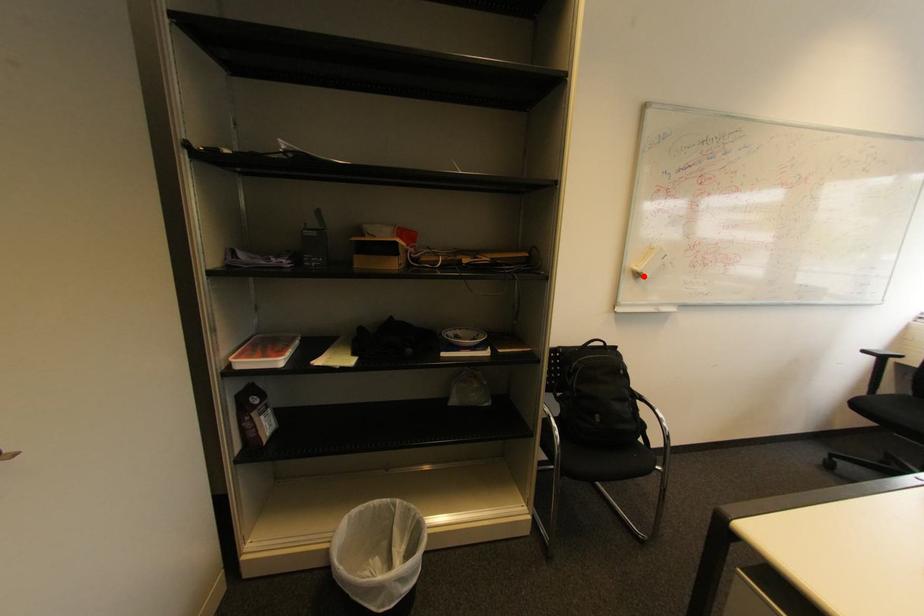
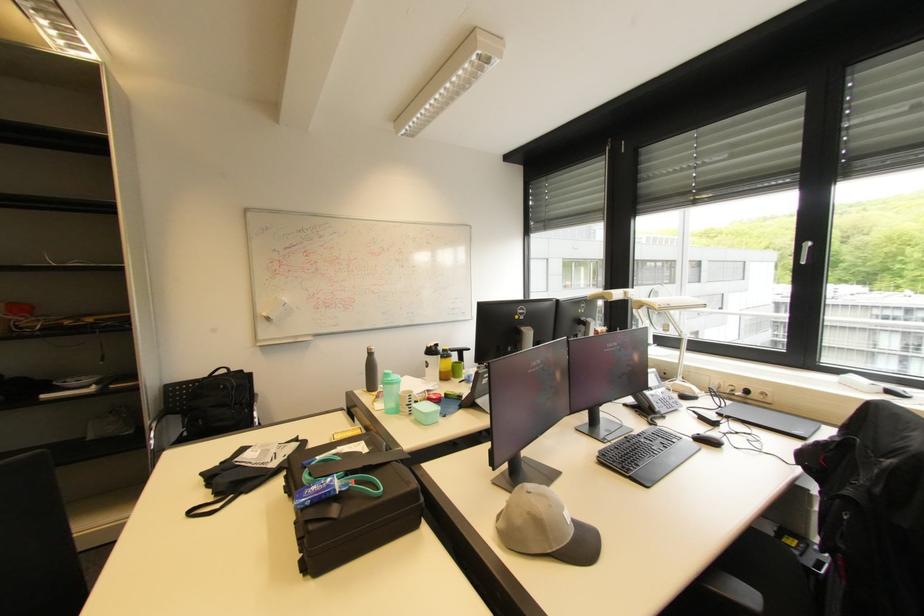
Locate, in the second image, the point that corresponds to the highlighted location in the first image.

(273, 320)